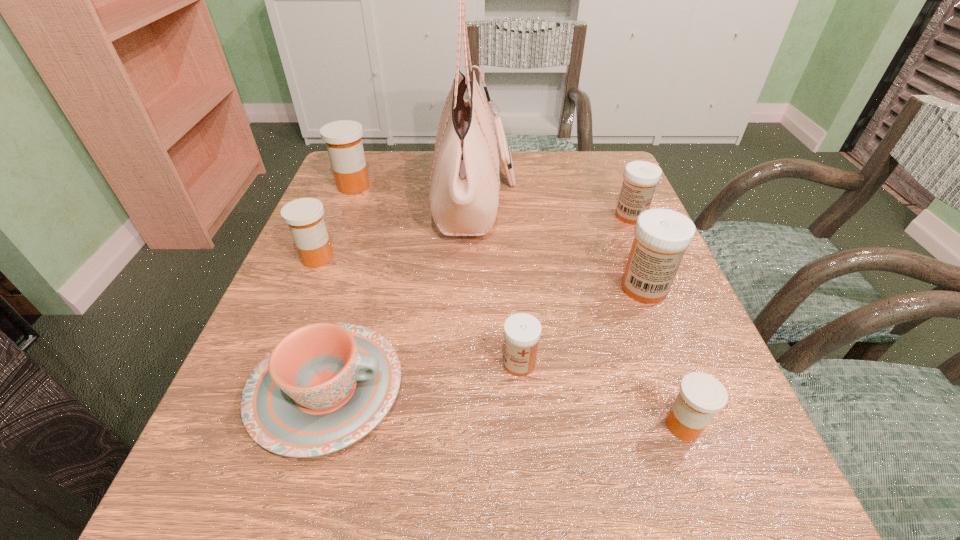
I want to click on free space between the nearest orange medicine and the farthest medicine, so click(518, 306).

The width and height of the screenshot is (960, 540). Find the location of `free point between the smallest orange medicine and the chinaware`. free point between the smallest orange medicine and the chinaware is located at coordinates (505, 408).

Identify the location of object that is the closest to the biggest white medicine. (640, 177).

Locate an element on the screen. the fourth closest object to the pink chinaware is located at coordinates (701, 395).

Image resolution: width=960 pixels, height=540 pixels. What are the coordinates of `medicine that stands as the fifth closest to the fifth farthest medicine` in the screenshot? It's located at (343, 140).

Select which medicine is the second closest to the farthest medicine. Please provide its 2D coordinates. Your answer should be formatted as a tuple, i.e. [(x, y)], where the tuple contains the x and y coordinates of a point satisfying the conditions above.

[(522, 331)]

Point out which orange medicine is positioned as the nearest to the nearest orange medicine. Please provide its 2D coordinates. Your answer should be formatted as a tuple, i.e. [(x, y)], where the tuple contains the x and y coordinates of a point satisfying the conditions above.

[(304, 216)]

Where is `the second closest orange medicine to the second farthest orange medicine`? This screenshot has width=960, height=540. the second closest orange medicine to the second farthest orange medicine is located at coordinates (701, 395).

Identify which white medicine is the third closest to the rightmost orange medicine. Please provide its 2D coordinates. Your answer should be formatted as a tuple, i.e. [(x, y)], where the tuple contains the x and y coordinates of a point satisfying the conditions above.

[(640, 177)]

Find the location of `white medicine object that ranks as the second closest to the biggest orange medicine`. white medicine object that ranks as the second closest to the biggest orange medicine is located at coordinates (640, 177).